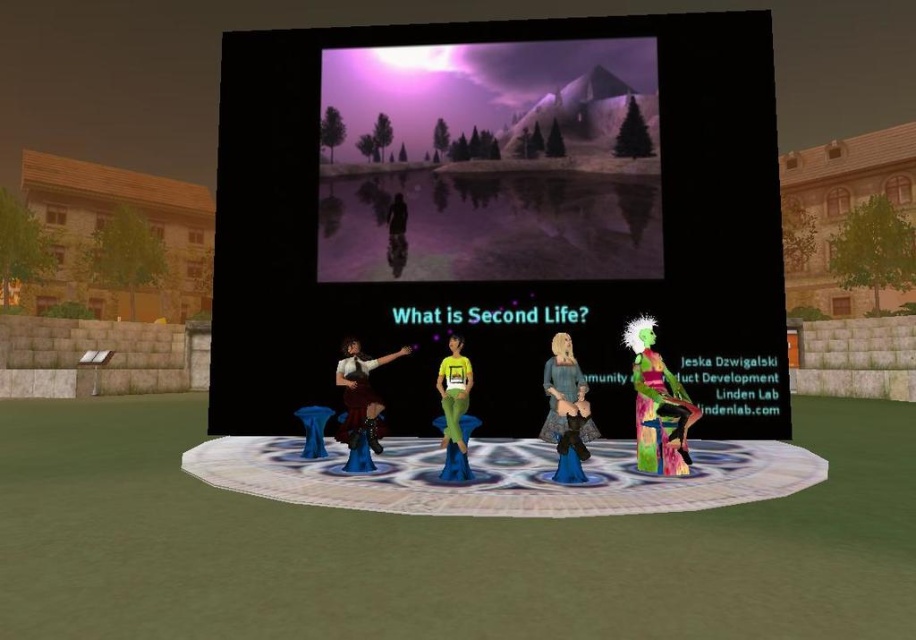
You are an avatar in Second Life attending a presentation. You need to pass a note to the person wearing the matte brown dress at center without being noticed. The person wearing the matte blue dress at center is sitting nearby. How far apart are the two dresses?

The matte brown dress at center and the matte blue dress at center are 4.78 feet apart.